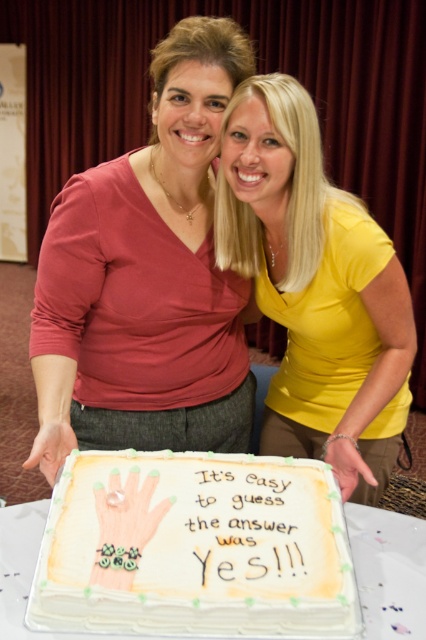
Question: Is ivory fondant cake at center below yellow matte shirt at center?

Choices:
 (A) yes
 (B) no

Answer: (A)

Question: Is matte red blouse at center to the right of yellow matte shirt at center from the viewer's perspective?

Choices:
 (A) yes
 (B) no

Answer: (B)

Question: Which object is positioned closest to the yellow matte shirt at center?

Choices:
 (A) matte red blouse at center
 (B) ivory fondant cake at center

Answer: (A)

Question: Which point appears farthest from the camera in this image?

Choices:
 (A) (235, 285)
 (B) (354, 310)
 (C) (141, 544)

Answer: (A)

Question: From the image, what is the correct spatial relationship of matte red blouse at center in relation to yellow matte shirt at center?

Choices:
 (A) left
 (B) right

Answer: (A)

Question: Estimate the real-world distances between objects in this image. Which object is farther from the yellow matte shirt at center?

Choices:
 (A) ivory fondant cake at center
 (B) matte red blouse at center

Answer: (A)